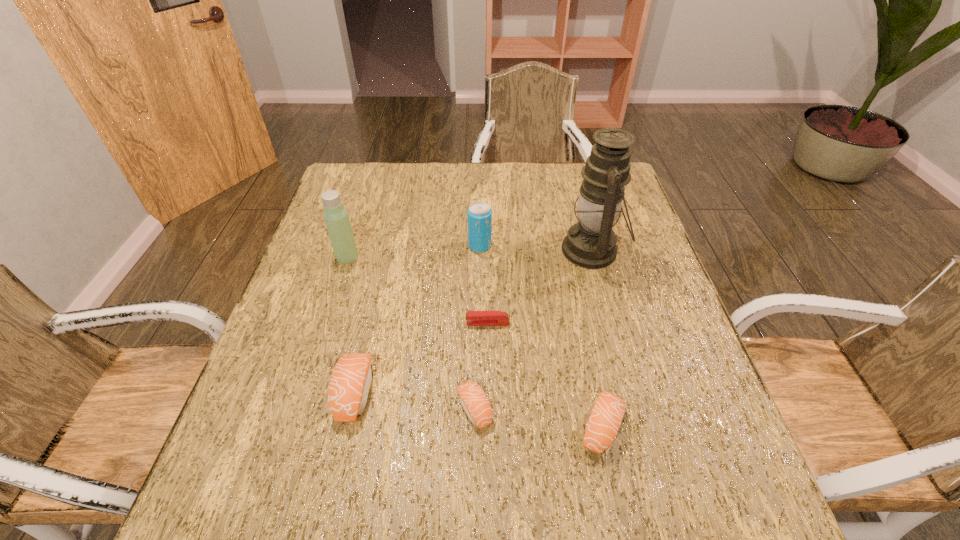
Where is `vacant space that's between the third tallest object and the fourth tallest object`? The image size is (960, 540). vacant space that's between the third tallest object and the fourth tallest object is located at coordinates (417, 319).

Where is `free space between the fourth shortest object and the sixth shortest object`? Image resolution: width=960 pixels, height=540 pixels. free space between the fourth shortest object and the sixth shortest object is located at coordinates (350, 325).

You are a GUI agent. You are given a task and a screenshot of the screen. Output one action in this format:
    pyautogui.click(x=<x>, y=<y>)
    Task: Click on the vacant point located between the shortest sushi and the tallest object
    The height and width of the screenshot is (540, 960).
    Given the screenshot: What is the action you would take?
    533,329

The height and width of the screenshot is (540, 960). What are the coordinates of `empty location between the thermos bottle and the soda can` in the screenshot? It's located at (414, 251).

Where is `vacant area that lies between the tallest sushi and the second sushi from left to right`? This screenshot has width=960, height=540. vacant area that lies between the tallest sushi and the second sushi from left to right is located at coordinates (414, 401).

Locate an element on the screen. This screenshot has height=540, width=960. free space between the fourth farthest object and the sixth shortest object is located at coordinates (418, 289).

Where is `object that is the fourth closest one to the stapler`? Image resolution: width=960 pixels, height=540 pixels. object that is the fourth closest one to the stapler is located at coordinates (603, 424).

You are a GUI agent. You are given a task and a screenshot of the screen. Output one action in this format:
    pyautogui.click(x=<x>, y=<y>)
    Task: Click on the fifth closest object to the leftmost sushi
    The height and width of the screenshot is (540, 960).
    Given the screenshot: What is the action you would take?
    pyautogui.click(x=603, y=424)

Locate an element on the screen. The image size is (960, 540). sushi that is the closest to the thermos bottle is located at coordinates (350, 382).

Select which sushi is the third closest to the stapler. Please provide its 2D coordinates. Your answer should be formatted as a tuple, i.e. [(x, y)], where the tuple contains the x and y coordinates of a point satisfying the conditions above.

[(603, 424)]